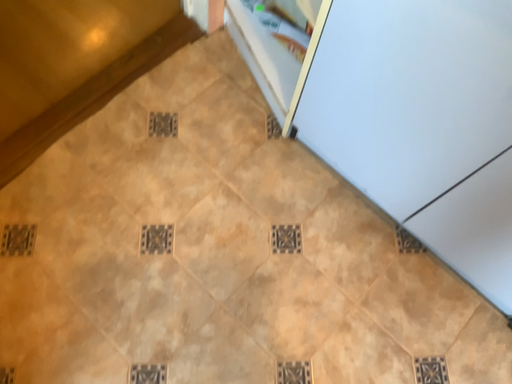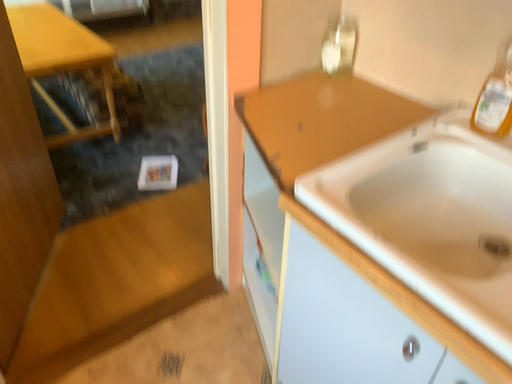
Question: Which way did the camera rotate in the video?

Choices:
 (A) rotated right
 (B) rotated left

Answer: (B)